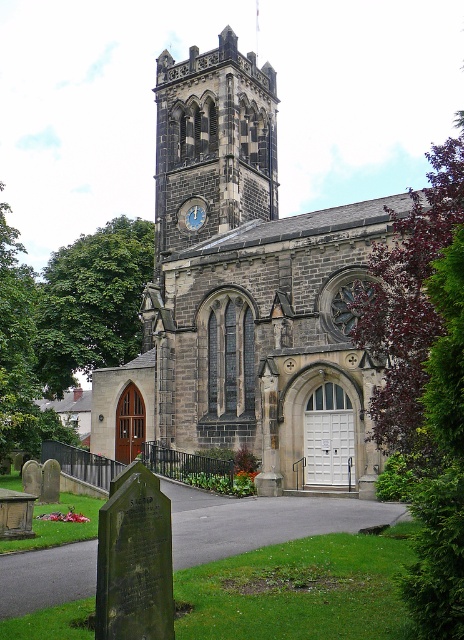
Does dark gray stone clock tower at upper center appear on the right side of blue stone clock at upper center?

Yes, dark gray stone clock tower at upper center is to the right of blue stone clock at upper center.

Based on the photo, does dark gray stone clock tower at upper center have a greater height compared to blue stone clock at upper center?

Correct, dark gray stone clock tower at upper center is much taller as blue stone clock at upper center.

Does point (219, 227) come in front of point (195, 209)?

Yes, it is in front of point (195, 209).

The image size is (464, 640). I want to click on dark gray stone clock tower at upper center, so click(x=213, y=141).

Who is positioned more to the left, dark gray stone church at center or dark gray stone clock tower at upper center?

From the viewer's perspective, dark gray stone church at center appears more on the left side.

Describe the element at coordinates (245, 296) in the screenshot. Image resolution: width=464 pixels, height=640 pixels. I see `dark gray stone church at center` at that location.

Find the location of a particular element. The width and height of the screenshot is (464, 640). dark gray stone church at center is located at coordinates (245, 296).

Looking at this image, who is more forward, (168, 132) or (193, 224)?

Point (193, 224) is in front.

Identify the location of dark gray stone church at center. The width and height of the screenshot is (464, 640). (245, 296).

What do you see at coordinates (245, 296) in the screenshot?
I see `dark gray stone church at center` at bounding box center [245, 296].

Identify the location of dark gray stone church at center. (245, 296).